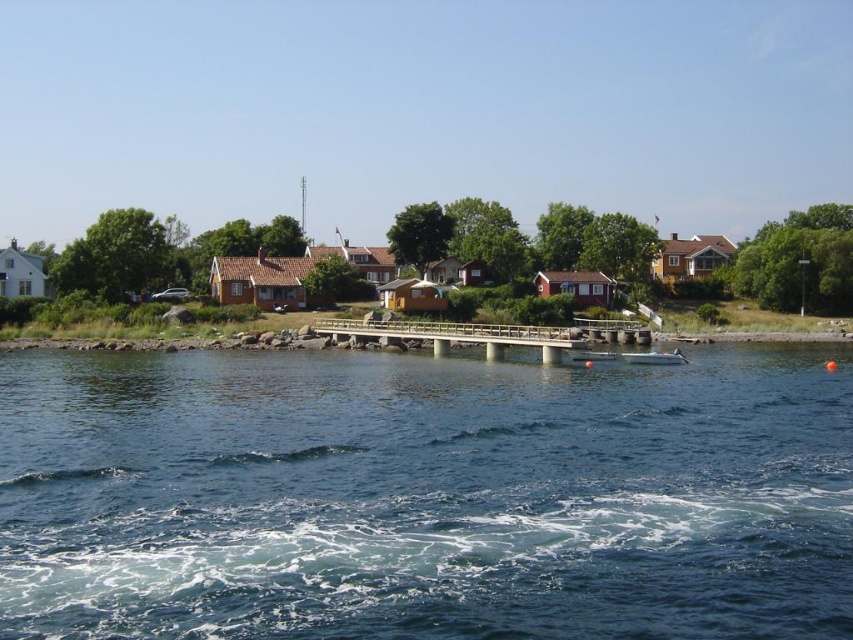
Question: Is blue water at lower center positioned in front of wooden bridge at center?

Choices:
 (A) no
 (B) yes

Answer: (B)

Question: Can you confirm if blue water at lower center is positioned above white glossy boat at center?

Choices:
 (A) yes
 (B) no

Answer: (B)

Question: Which of the following is the farthest from the observer?

Choices:
 (A) click(x=631, y=355)
 (B) click(x=456, y=339)

Answer: (B)

Question: Which of the following is the closest to the observer?

Choices:
 (A) white glossy boat at center
 (B) blue water at lower center
 (C) wooden bridge at center

Answer: (B)

Question: Does blue water at lower center lie behind white glossy boat at center?

Choices:
 (A) yes
 (B) no

Answer: (B)

Question: Which object appears farthest from the camera in this image?

Choices:
 (A) wooden bridge at center
 (B) blue water at lower center

Answer: (A)